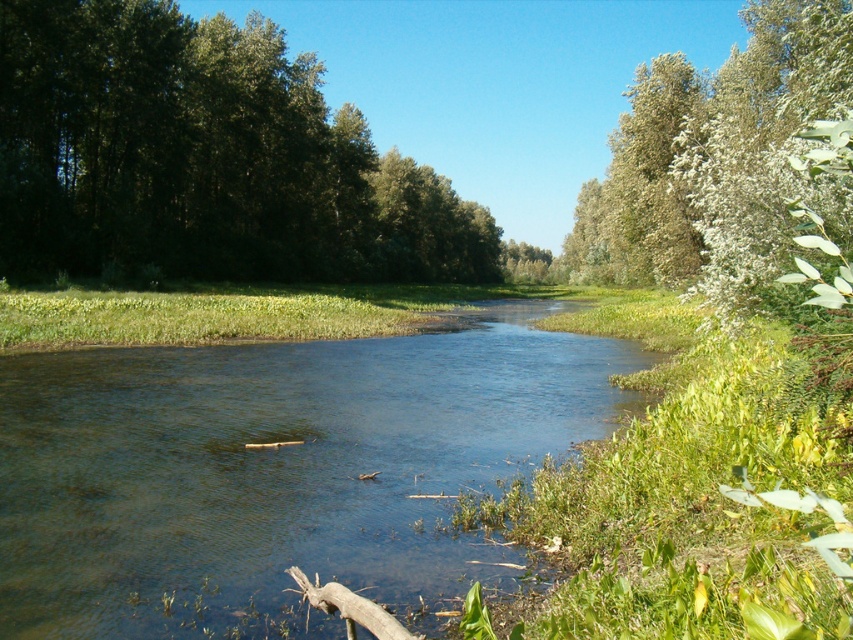
Based on the photo, you are standing at the edge of the river and see two points marked in the image. Which point, point (426, 337) or point (12, 230), is closer to you?

Point (426, 337) is closer to you than point (12, 230).

Based on the photo, you are standing at point (204, 157) in the image. Looking around, you see green leafy trees at left. Which direction should you walk to move away from the green leafy trees at left?

To move away from the green leafy trees at left, you should walk to the right since the green leafy trees at left are on your left side.

You are standing at the edge of the river on the left side, where the trees are dense and shadowy. You want to cross to the right side where the vegetation is lighter. According to the coordinates provided, where exactly is the clear water at center located that you should aim for to cross safely?

The clear water at center is located at coordinates point [277,468]. You should aim for that point to cross safely.